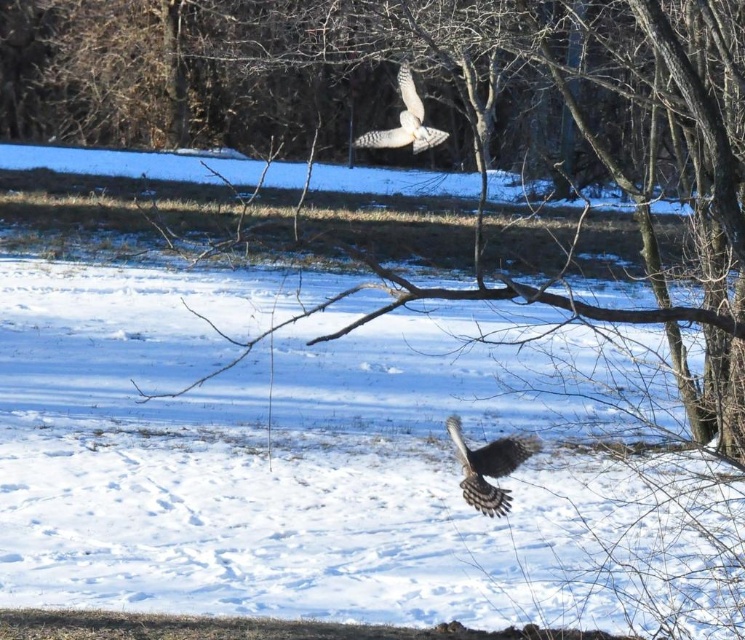
Question: Can you confirm if speckled brown hawk at center is positioned to the left of white speckled feathers at upper center?

Choices:
 (A) no
 (B) yes

Answer: (A)

Question: Which point is closer to the camera?

Choices:
 (A) speckled brown hawk at center
 (B) white speckled feathers at upper center

Answer: (B)

Question: Where is speckled brown hawk at center located in relation to white speckled feathers at upper center in the image?

Choices:
 (A) below
 (B) above

Answer: (A)

Question: Is speckled brown hawk at center bigger than white speckled feathers at upper center?

Choices:
 (A) no
 (B) yes

Answer: (A)

Question: Which point is closer to the camera taking this photo?

Choices:
 (A) click(x=457, y=451)
 (B) click(x=408, y=104)

Answer: (B)